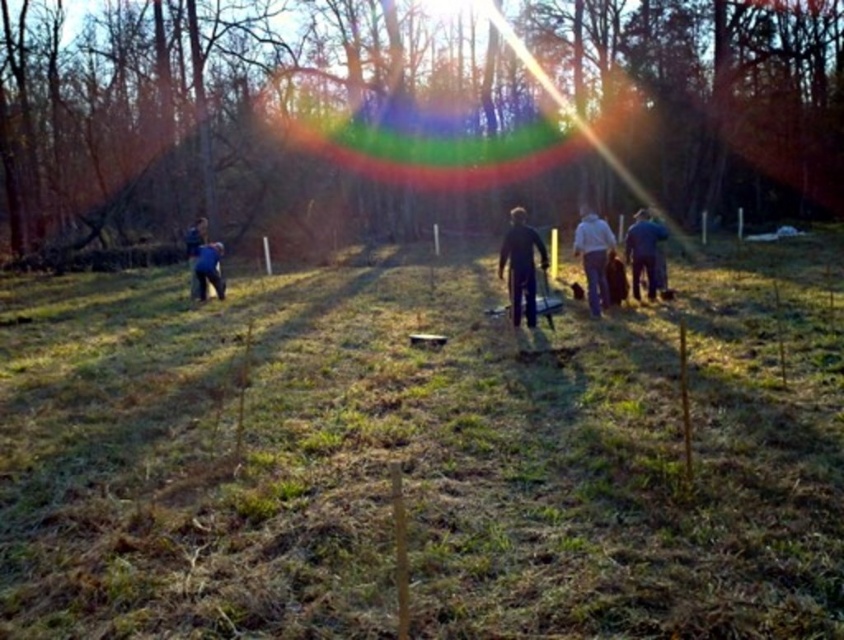
You are standing in the wooded area and see the green grass at center and the white cotton shirt at center. Which object is closer to the ground?

The green grass at center is located below the white cotton shirt at center, so it is closer to the ground.

You are planning to set up a picnic blanket in the wooded area. The green grass at center and the white cotton shirt at center are both in your way. Which object should you move first to clear the space?

The green grass at center is larger in size than the white cotton shirt at center, so you should move the green grass at center first to clear the space.

You are planning to set up a picnic blanket in the wooded area. The green grass at center and the blue fabric person at left are both visible from your current position. Which area has more space to spread out the blanket?

The green grass at center has more space to spread out the picnic blanket because its width surpasses that of the blue fabric person at left.